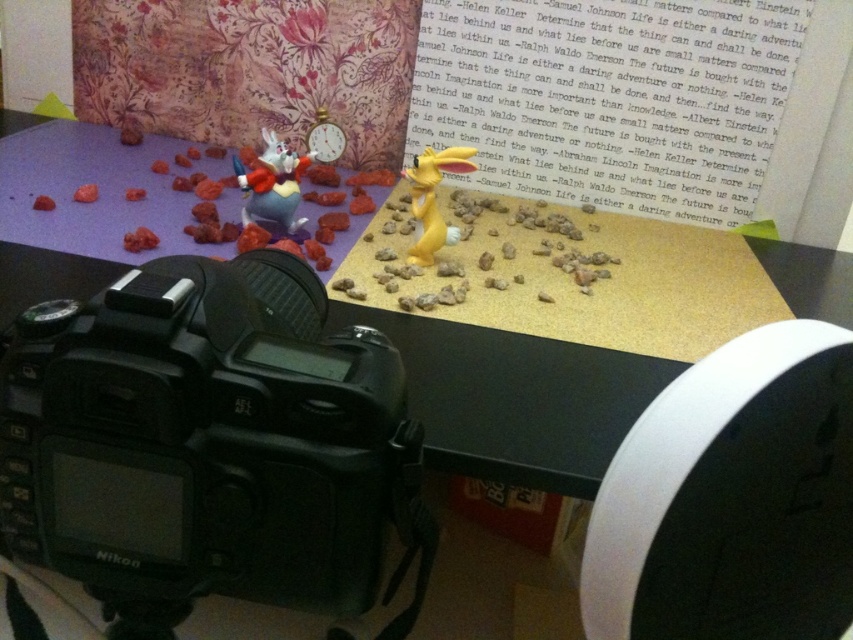
Question: Which is farther from the yellow matte rabbit at center?

Choices:
 (A) matte plastic rabbit at upper left
 (B) black plastic camera at lower left

Answer: (B)

Question: Which object appears farthest from the camera in this image?

Choices:
 (A) black plastic camera at lower left
 (B) yellow matte rabbit at center
 (C) matte plastic rabbit at upper left

Answer: (C)

Question: Does black plastic camera at lower left appear on the right side of yellow matte rabbit at center?

Choices:
 (A) no
 (B) yes

Answer: (A)

Question: Among these points, which one is nearest to the camera?

Choices:
 (A) (421, 168)
 (B) (113, 410)

Answer: (B)

Question: Is the position of black plastic camera at lower left less distant than that of yellow matte rabbit at center?

Choices:
 (A) yes
 (B) no

Answer: (A)

Question: Is matte plastic rabbit at upper left to the left of yellow matte rabbit at center from the viewer's perspective?

Choices:
 (A) yes
 (B) no

Answer: (A)